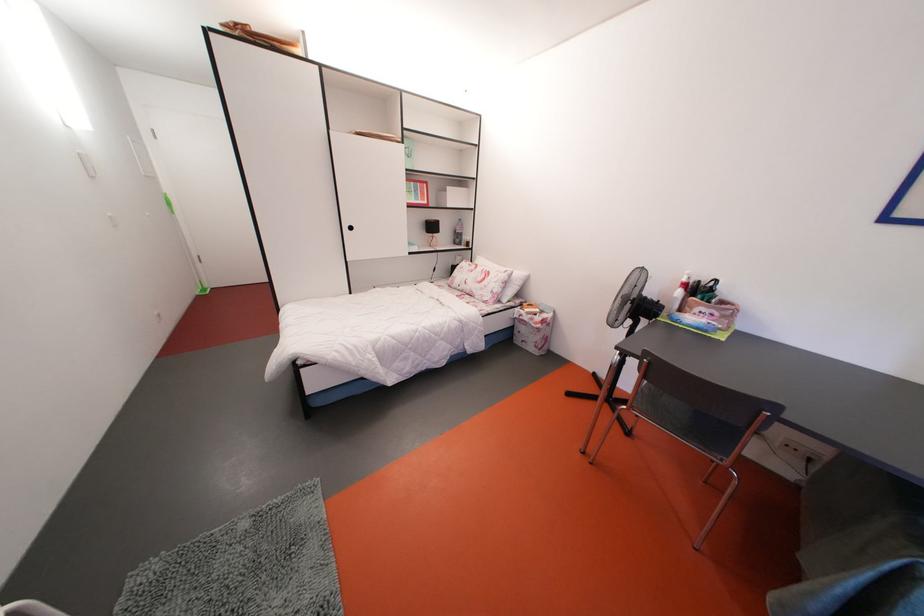
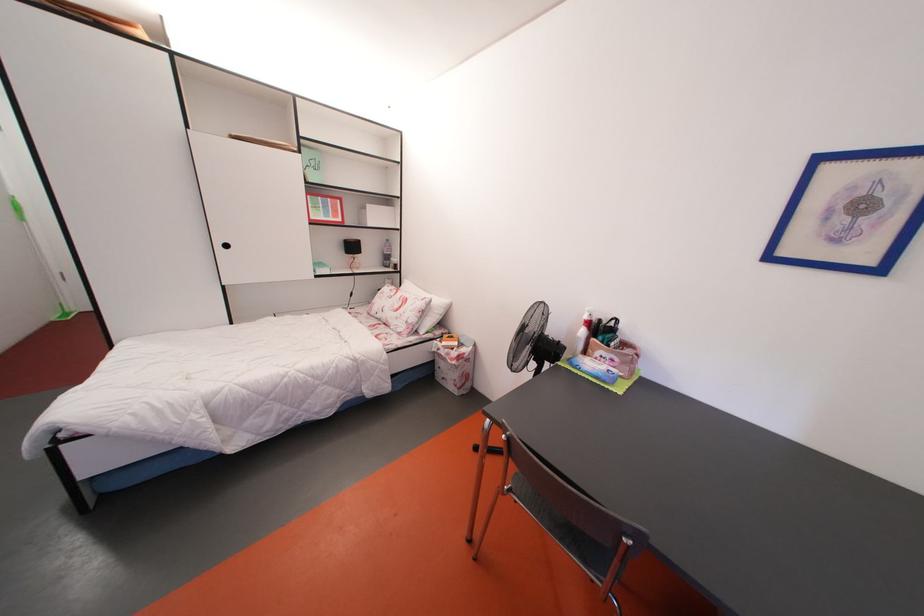
Question: How did the camera likely rotate?

Choices:
 (A) Left
 (B) Right
 (C) Up
 (D) Down

Answer: (B)